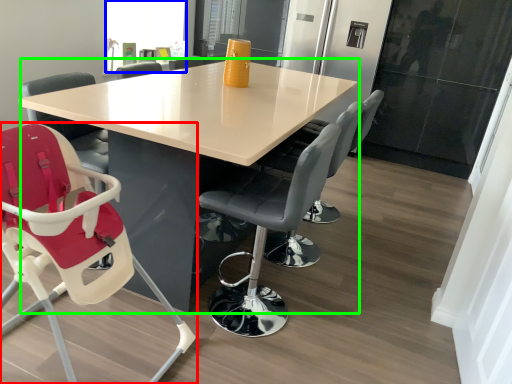
Question: Estimate the real-world distances between objects in this image. Which object is farther from chair (highlighted by a red box), window screen (highlighted by a blue box) or table (highlighted by a green box)?

Choices:
 (A) window screen
 (B) table

Answer: (A)